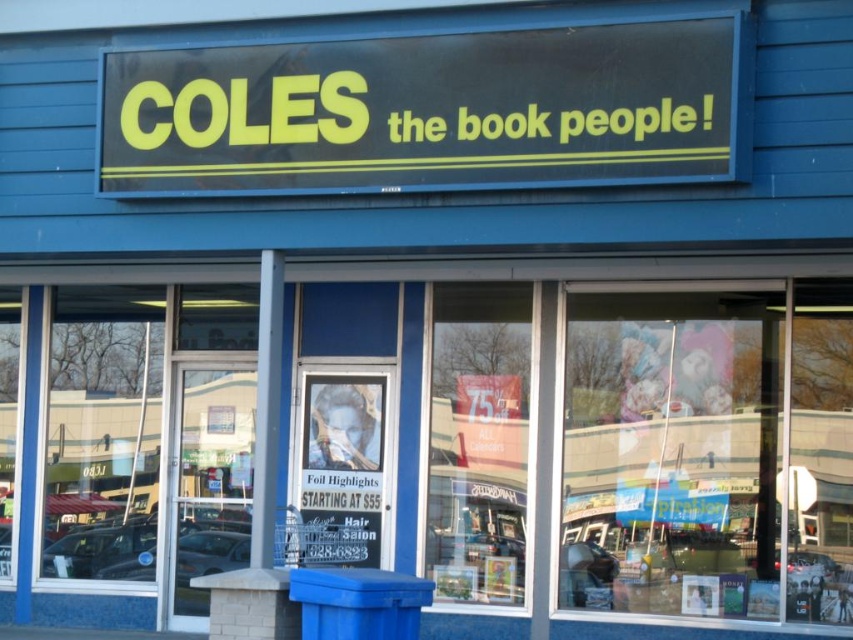
You are standing in front of the bookstore and see two points marked on the glass doors. The first point is at coordinate point(456, 356) and the second is at point(332, 416). Which point is closer to you?

Point(456, 356) is in front of point(332, 416), so it is closer to you.

You are standing outside the bookstore and want to see the items inside. Where should you look to see through the transparent glass window at center?

You should look at the transparent glass window at center located at point (479, 442) to see the items inside the store.

You are a customer standing outside the bookstore looking through the transparent glass window at center. Can you see the metallic poster at center from your current position?

The metallic poster at center is behind the transparent glass window at center, so yes, you can see the metallic poster at center through the window.